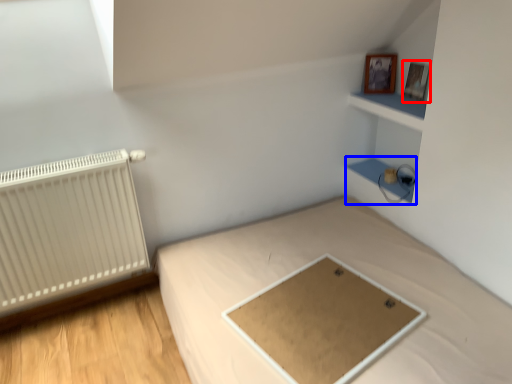
Question: Which object appears closest to the camera in this image, picture frame (highlighted by a red box) or cabinet (highlighted by a blue box)?

Choices:
 (A) picture frame
 (B) cabinet

Answer: (A)